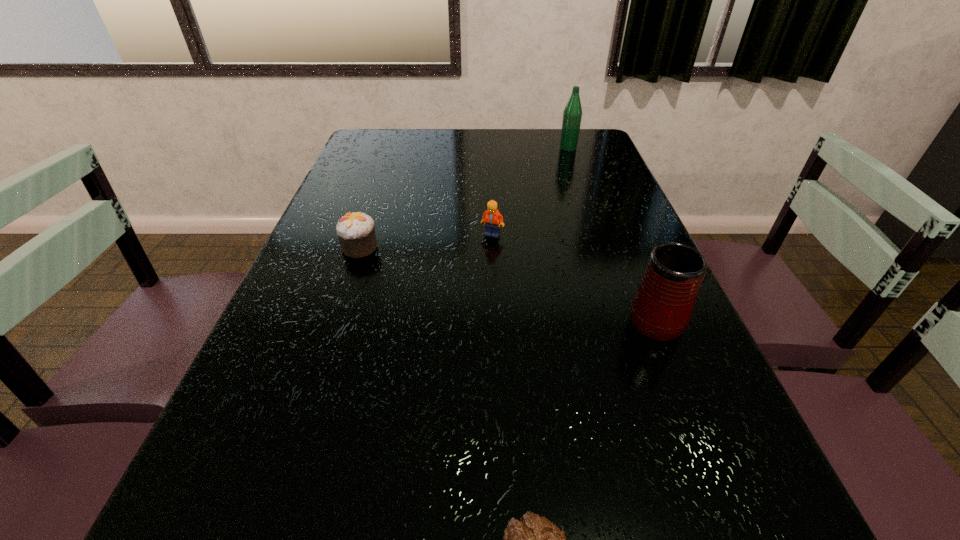
This screenshot has height=540, width=960. Find the location of `the tallest object`. the tallest object is located at coordinates (572, 115).

Where is `bottle`? The width and height of the screenshot is (960, 540). bottle is located at coordinates (572, 115).

The image size is (960, 540). In order to click on the fourth farthest object in this screenshot , I will do `click(661, 308)`.

The image size is (960, 540). I want to click on mug, so click(x=661, y=308).

The height and width of the screenshot is (540, 960). What are the coordinates of `Lego` in the screenshot? It's located at (491, 217).

Where is `cupcake`? cupcake is located at coordinates (356, 232).

The image size is (960, 540). I want to click on vacant area situated 0.120m on the left of the bottle, so click(x=524, y=148).

At what (x,y) coordinates should I click in order to perform the action: click on free point located on the side of the second tallest object with the handle. Please return your answer as a coordinate pair (x, y). The width and height of the screenshot is (960, 540). Looking at the image, I should click on coord(636,272).

The height and width of the screenshot is (540, 960). In order to click on free space located 0.230m on the side of the second tallest object with the handle in this screenshot , I will do `click(618, 230)`.

Image resolution: width=960 pixels, height=540 pixels. Find the location of `free space located on the side of the second tallest object with the handle`. free space located on the side of the second tallest object with the handle is located at coordinates (610, 210).